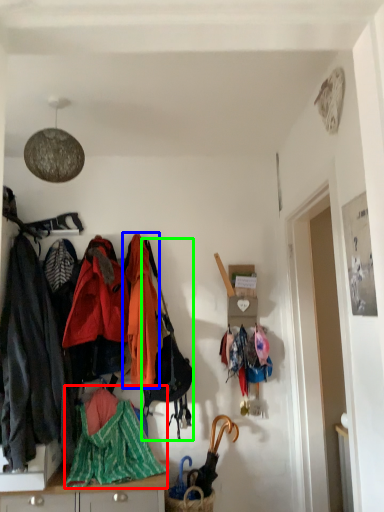
Question: Which object is the farthest from blanket (highlighted by a red box)? Choose among these: jacket (highlighted by a blue box) or handbag (highlighted by a green box).

Choices:
 (A) jacket
 (B) handbag

Answer: (A)